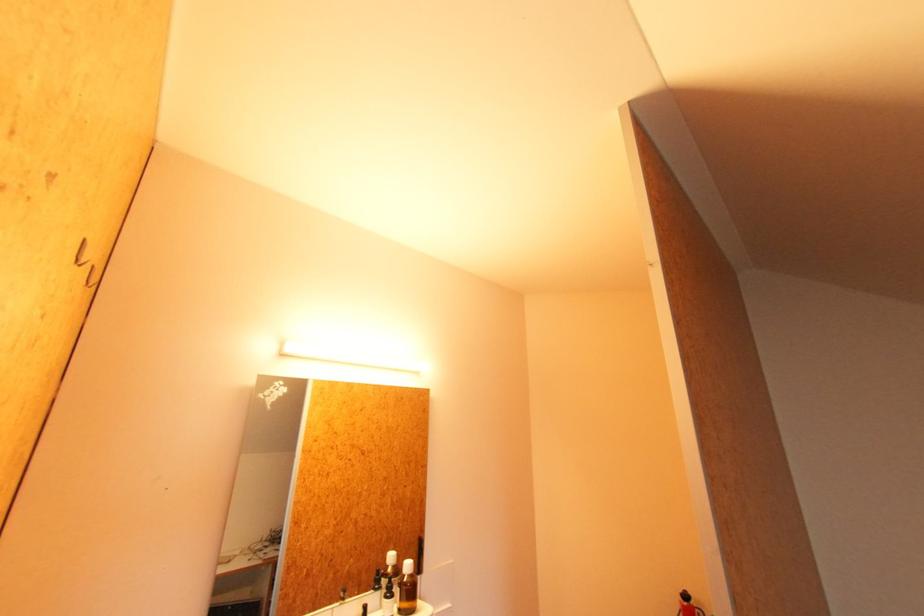
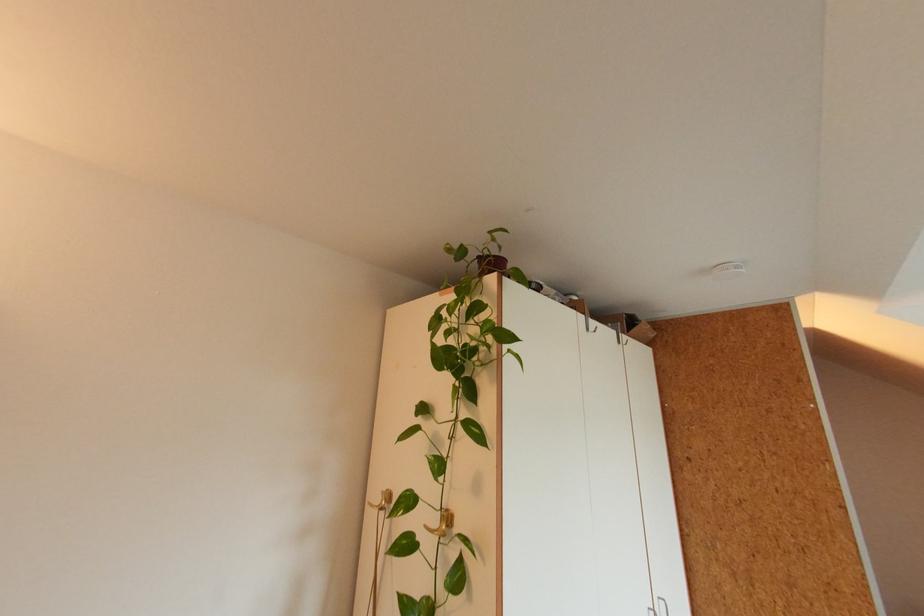
What movement of the cameraman would produce the second image?

The movement direction of the cameraman is left, backward.